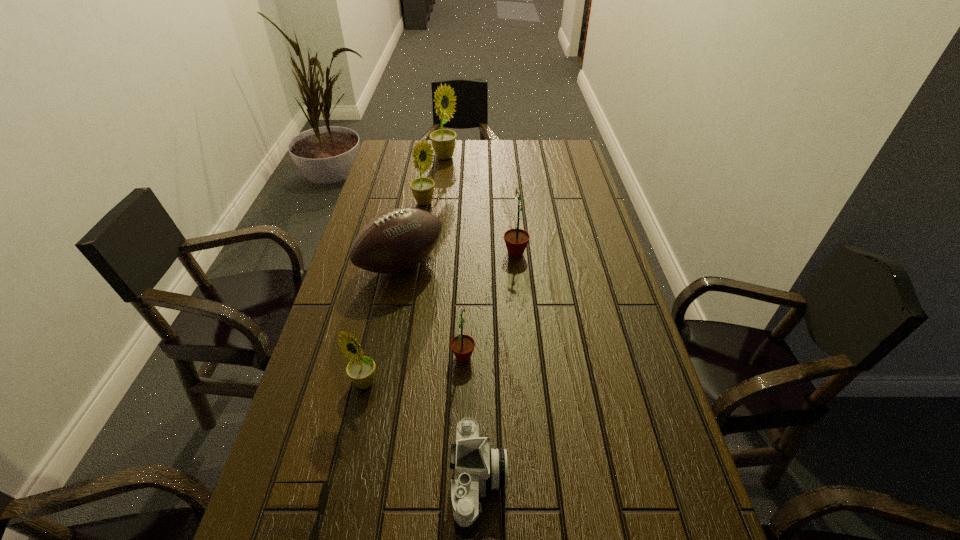
Where is `sunflower that stands as the third closest to the second shortest object`? Image resolution: width=960 pixels, height=540 pixels. sunflower that stands as the third closest to the second shortest object is located at coordinates (516, 240).

At what (x,y) coordinates should I click in order to perform the action: click on sunflower that is the fourth closest to the sunglasses. Please return your answer as a coordinate pair (x, y). The width and height of the screenshot is (960, 540). Looking at the image, I should click on (422, 188).

Locate which yellow sunflower ranks second in proximity to the second farthest object. Please provide its 2D coordinates. Your answer should be formatted as a tuple, i.e. [(x, y)], where the tuple contains the x and y coordinates of a point satisfying the conditions above.

[(361, 369)]

I want to click on yellow sunflower that is the third nearest to the black sunglasses, so click(443, 141).

Identify the location of vacant space that satisfies the following two spatial constraints: 1. on the face of the fourth nearest sunflower; 2. on the face of the smallest yellow sunflower. This screenshot has height=540, width=960. (395, 383).

The height and width of the screenshot is (540, 960). Identify the location of vacant area in the image that satisfies the following two spatial constraints: 1. on the face of the second nearest yellow sunflower; 2. on the face of the third nearest object. coord(395,383).

Identify the location of free space that satisfies the following two spatial constraints: 1. on the face of the farthest yellow sunflower; 2. on the face of the nearest yellow sunflower. The height and width of the screenshot is (540, 960). (418, 383).

You are a GUI agent. You are given a task and a screenshot of the screen. Output one action in this format:
    pyautogui.click(x=<x>, y=<y>)
    Task: Click on the vacant space that satisfies the following two spatial constraints: 1. on the face of the second farthest yellow sunflower; 2. on the face of the nearest sunflower
    The image size is (960, 540).
    Given the screenshot: What is the action you would take?
    pyautogui.click(x=395, y=383)